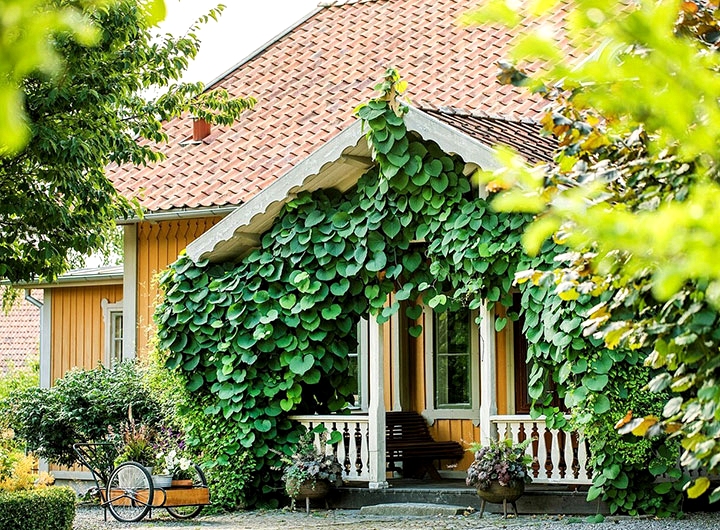
Find the location of a particular element. grey window frames is located at coordinates tap(458, 416).